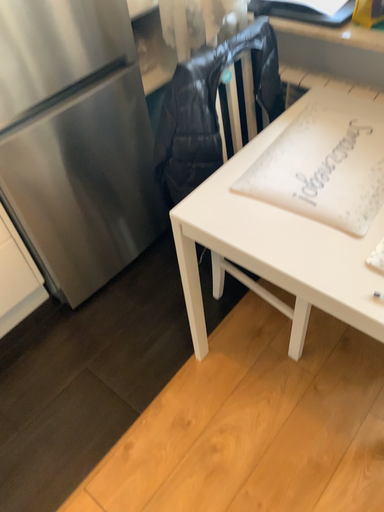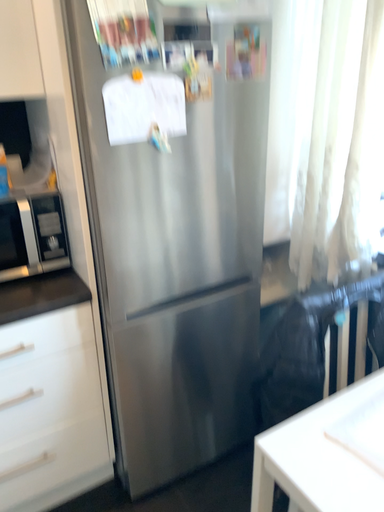
Question: Which way did the camera rotate in the video?

Choices:
 (A) rotated left
 (B) rotated right

Answer: (A)